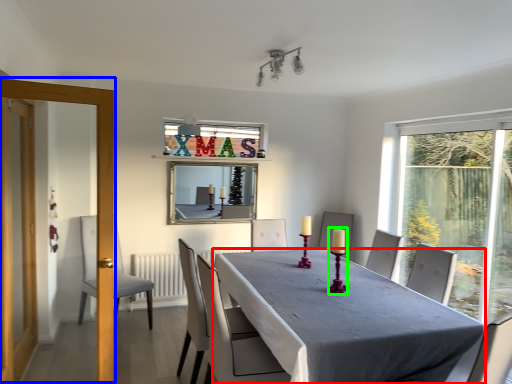
Question: Which object is positioned farthest from table (highlighted by a red box)? Select from screen door (highlighted by a blue box) and candle holder (highlighted by a green box).

Choices:
 (A) screen door
 (B) candle holder

Answer: (A)